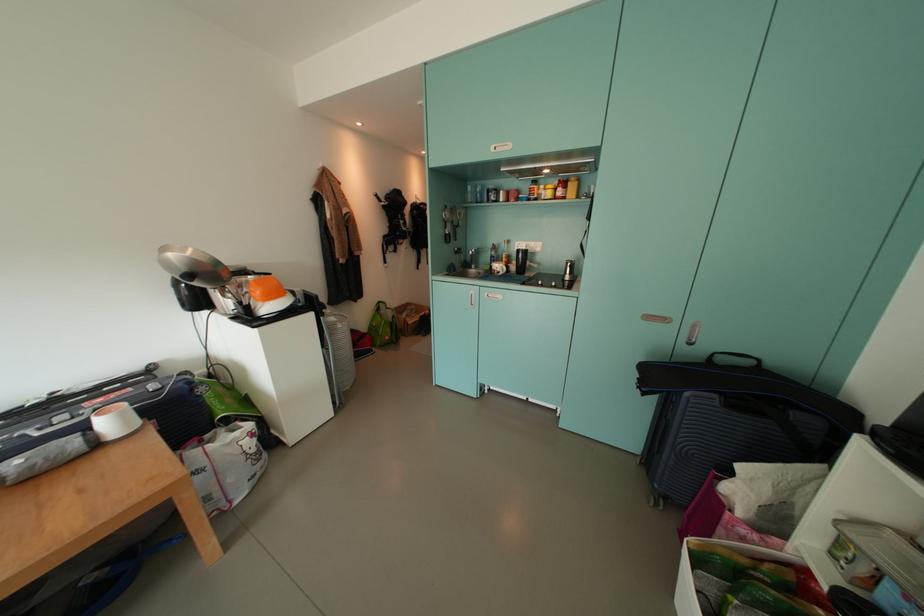
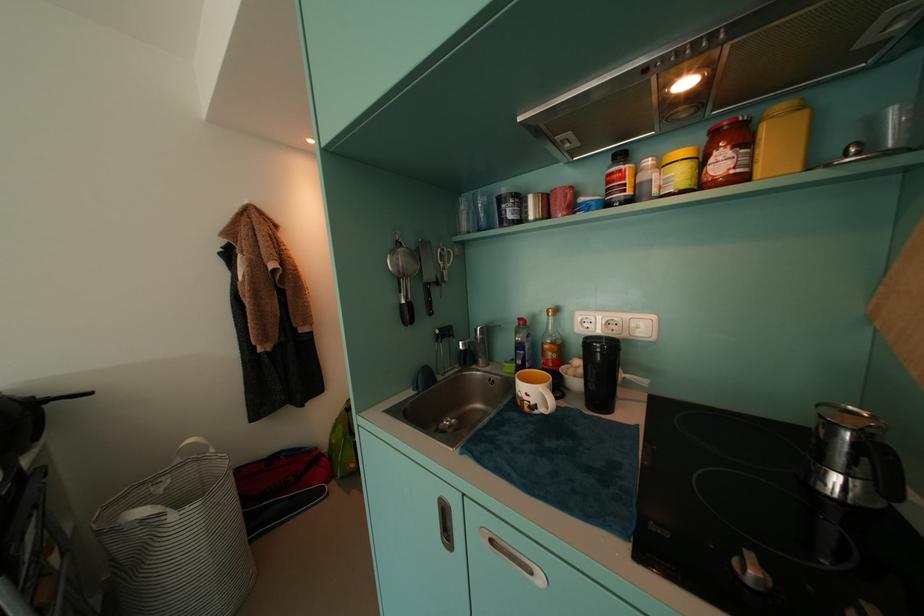
In the second image, find the point that corresponds to (x=529, y=272) in the first image.

(610, 395)